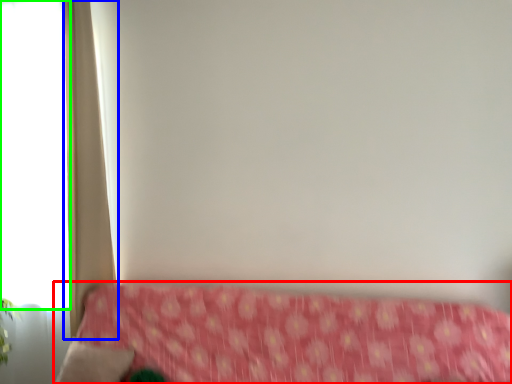
Question: Which object is positioned farthest from furniture (highlighted by a red box)? Select from curtain (highlighted by a blue box) and window (highlighted by a green box).

Choices:
 (A) curtain
 (B) window

Answer: (B)